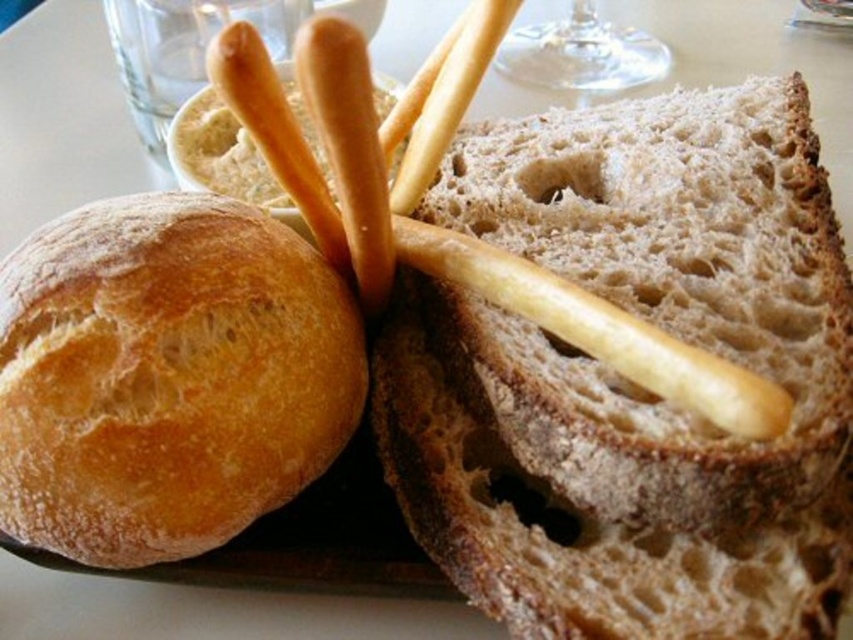
You are setting up a table for a dinner party and need to place the brown crusty bread at center and the transparent glass wine glass at upper center. Given their sizes, which item will require more space on the table?

The brown crusty bread at center has a larger size compared to the transparent glass wine glass at upper center, so it will require more space on the table.

You are arranging bread on a display shelf and want to place the brown crusty bread at center and the golden brown crusty bread at left so that both are visible. Based on their positions in the image, which bread should you move to ensure both are fully visible?

The brown crusty bread at center is in front of the golden brown crusty bread at left. To ensure both are fully visible, you should move the brown crusty bread at center to the side so that it is no longer blocking the golden brown crusty bread at left.

Based on the photo, you are setting up a dinner table and want to place the brown crusty bread at center and the transparent glass wine glass at upper center. According to the image, is the current arrangement safe for pouring wine without spilling?

The brown crusty bread at center is positioned under the transparent glass wine glass at upper center, so pouring wine into the transparent glass wine glass at upper center might cause spills onto the brown crusty bread at center. Adjust the placement to avoid this issue.